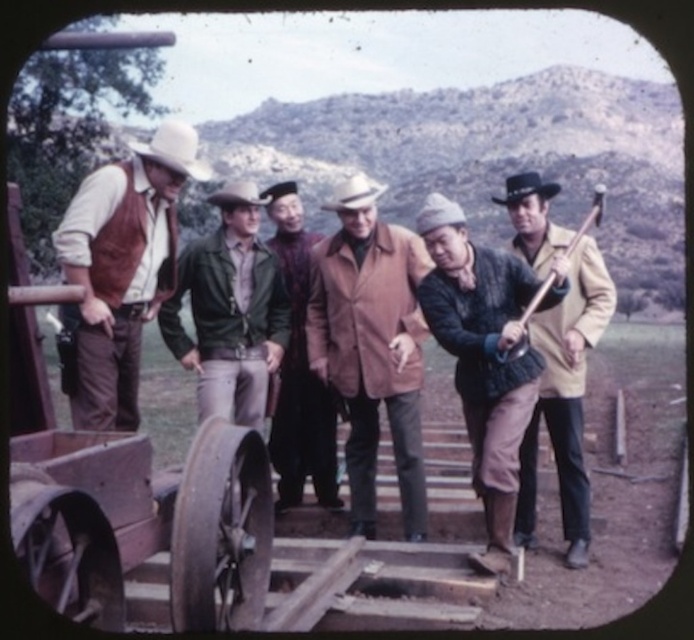
You are a costume designer looking at the image of the group in the rural setting. You need to determine the spatial arrangement of the leather jacket at center and the brown felt cowboy hat at center for a scene setup. Which object is positioned to the right of the other?

The leather jacket at center is to the right of the brown felt cowboy hat at center, so the leather jacket at center is positioned to the right of the brown felt cowboy hat at center.

You are a costume designer preparing for a scene where you need to ensure that the leather jacket at center and the brown felt cowboy hat at center fit within a narrow display case. The case can only accommodate items narrower than the other. Which item should you place in the case first to ensure both fit?

The leather jacket at center has a lesser width compared to the brown felt cowboy hat at center. Therefore, place the leather jacket at center first, then the brown felt cowboy hat at center, as the case requires items narrower than the other, and the jacket is narrower.

You are a costume designer looking at the scene. You need to determine the spatial relationship between the brown wool coat at center and the brown felt cowboy hat at center. Which object is positioned to the right of the other?

The brown wool coat at center is to the right of brown felt cowboy hat at center.